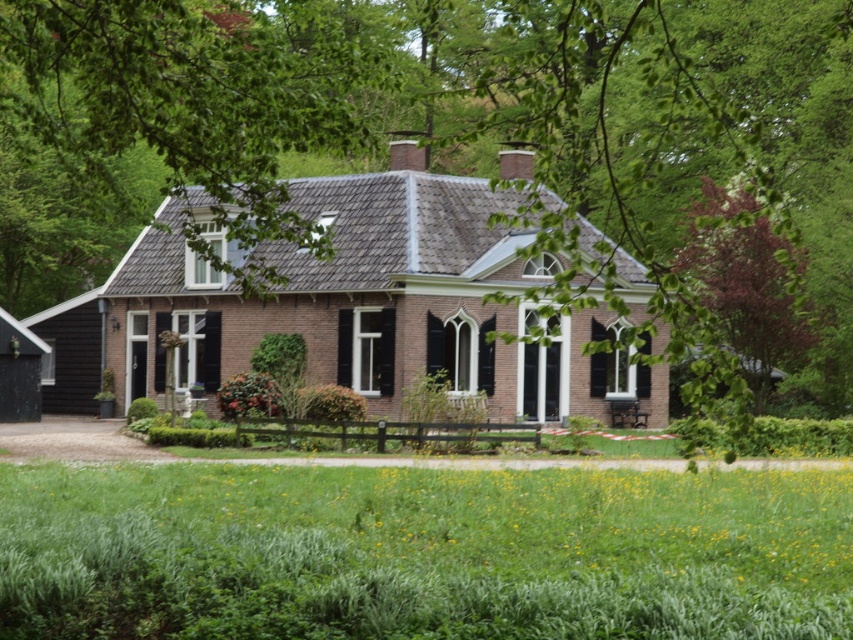
Question: Which point is farther to the camera?

Choices:
 (A) (439, 186)
 (B) (743, 49)

Answer: (B)

Question: Is green leafy tree at upper center closer to the viewer compared to brown brick cottage at center?

Choices:
 (A) yes
 (B) no

Answer: (A)

Question: Where is green leafy tree at upper center located in relation to brown brick cottage at center in the image?

Choices:
 (A) below
 (B) above

Answer: (B)

Question: Which point is farther to the camera?

Choices:
 (A) brown brick cottage at center
 (B) green leafy tree at upper center

Answer: (A)

Question: Which of the following is the farthest from the observer?

Choices:
 (A) green leafy tree at upper center
 (B) brown brick cottage at center

Answer: (B)

Question: Is green leafy tree at upper center to the right of brown brick cottage at center from the viewer's perspective?

Choices:
 (A) no
 (B) yes

Answer: (B)